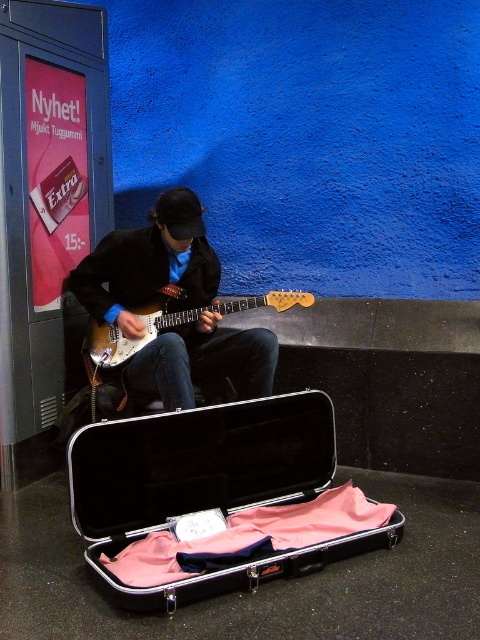
You are a street performer who has two guitars, the matte black guitar at center and the sunburst wood electric guitar at center. You need to choose one to play. Which guitar is taller and thus might be more comfortable for your tall frame?

The matte black guitar at center is taller than the sunburst wood electric guitar at center, so it might be more comfortable for your tall frame.

You are a street performer who just finished your set. You need to pack your sunburst wood electric guitar at center into your metallic black case at lower center. Based on their positions, can you place the guitar into the case?

The metallic black case at lower center is below the sunburst wood electric guitar at center, so the guitar is already positioned above the case. This makes it possible to place the guitar into the case as they are aligned vertically.

Consider the image. You are a street performer who just finished your set. You need to pack your sunburst wood electric guitar at center into your metallic black case at lower center. Given that the distance between them is 35.28 inches, can you estimate how many steps you need to take to reach the case from the guitar?

The metallic black case at lower center is 35.28 inches away from the sunburst wood electric guitar at center. Assuming an average step length of about 28 inches, you would need to take approximately 1.26 steps, which rounds up to 2 steps to reach the case from the guitar.